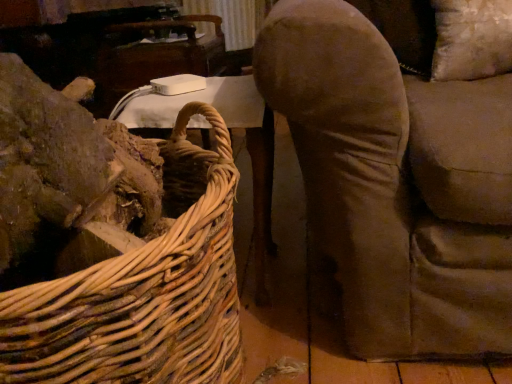
Question: From the image's perspective, relative to white plastic table at upper left, arranged as the 2th table when viewed from the top, is woven natural wood picnic basket at left above or below?

Choices:
 (A) below
 (B) above

Answer: (A)

Question: Based on their sizes in the image, would you say woven natural wood picnic basket at left is bigger or smaller than white plastic table at upper left, arranged as the 2th table when viewed from the top?

Choices:
 (A) big
 (B) small

Answer: (A)

Question: Which object is the farthest from the woven natural wood picnic basket at left?

Choices:
 (A) white plastic table at upper center, marked as the second table in a front-to-back arrangement
 (B) white plastic table at upper left, the 1th table when ordered from bottom to top

Answer: (A)

Question: Estimate the real-world distances between objects in this image. Which object is closer to the woven natural wood picnic basket at left?

Choices:
 (A) white plastic table at upper left, the 1th table when ordered from bottom to top
 (B) white plastic table at upper center, positioned as the first table in back-to-front order

Answer: (A)